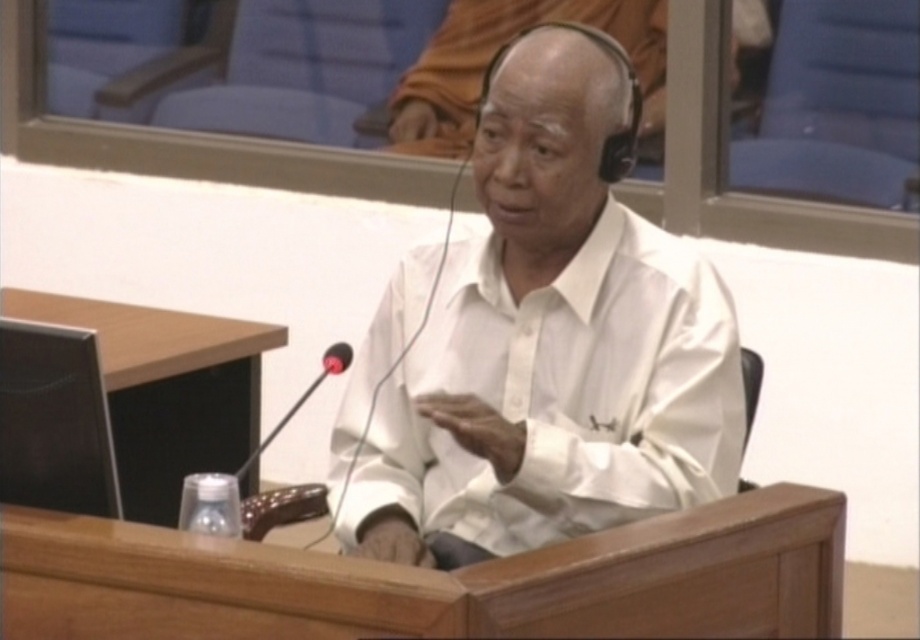
You are a photographer setting up for a formal event. You need to ensure that the white matte shirt at center is visible in the frame without being obscured by the black matte microphone at center. Based on their sizes, can the shirt be positioned so that it remains fully visible?

The white matte shirt at center might be wider than black matte microphone at center, so there is a possibility that the shirt can be positioned to remain fully visible without obstruction from the microphone.

You are a sound technician preparing for an event. You need to choose between the black matte microphone at center and the black rubber microphone at center based on their sizes. Which one should you pick if you require a larger microphone for better visibility?

The black matte microphone at center is larger in size than the black rubber microphone at center, so you should pick the black matte microphone at center for better visibility.

Where is the white matte shirt at center located in the image?

The white matte shirt at center is located at the 2D coordinates point (552, 344).